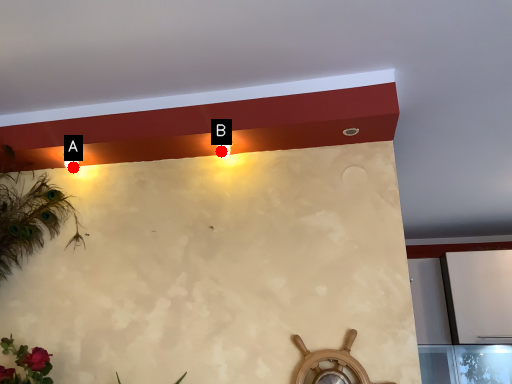
Question: Two points are circled on the image, labeled by A and B beside each circle. Which point is further to the camera?

Choices:
 (A) A is further
 (B) B is further

Answer: (A)